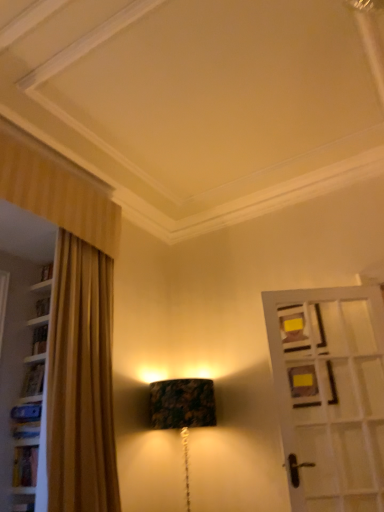
At what (x,y) coordinates should I click in order to perform the action: click on marble-patterned lampshade at center. Please return your answer as a coordinate pair (x, y). This screenshot has height=512, width=384. Looking at the image, I should click on (182, 410).

The width and height of the screenshot is (384, 512). Describe the element at coordinates (182, 410) in the screenshot. I see `marble-patterned lampshade at center` at that location.

What do you see at coordinates (330, 395) in the screenshot? I see `white wooden door at right` at bounding box center [330, 395].

Identify the location of white wooden door at right. This screenshot has height=512, width=384. (330, 395).

What is the approximate height of white wooden door at right?

It is 1.28 meters.

You are a GUI agent. You are given a task and a screenshot of the screen. Output one action in this format:
    pyautogui.click(x=<x>, y=<y>)
    Task: Click on the marble-patterned lampshade at center
    The image size is (384, 512).
    Given the screenshot: What is the action you would take?
    pyautogui.click(x=182, y=410)

Is white wooden door at right to the left of marble-patterned lampshade at center from the viewer's perspective?

Incorrect, white wooden door at right is not on the left side of marble-patterned lampshade at center.

Which is in front, white wooden door at right or marble-patterned lampshade at center?

Positioned in front is white wooden door at right.

Is point (331, 383) positioned after point (196, 426)?

No, it is in front of (196, 426).

From the image's perspective, which one is positioned higher, white wooden door at right or marble-patterned lampshade at center?

white wooden door at right is shown above in the image.

From the picture: From a real-world perspective, relative to marble-patterned lampshade at center, is white wooden door at right vertically above or below?

white wooden door at right is above marble-patterned lampshade at center.

Is white wooden door at right wider or thinner than marble-patterned lampshade at center?

In the image, white wooden door at right appears to be more narrow than marble-patterned lampshade at center.

Based on the photo, from their relative heights in the image, would you say white wooden door at right is taller or shorter than marble-patterned lampshade at center?

Clearly, white wooden door at right is taller compared to marble-patterned lampshade at center.

Can you confirm if white wooden door at right is smaller than marble-patterned lampshade at center?

Correct, white wooden door at right occupies less space than marble-patterned lampshade at center.

Is marble-patterned lampshade at center surrounded by white wooden door at right?

No.

Is white wooden door at right touching marble-patterned lampshade at center?

There is a gap between white wooden door at right and marble-patterned lampshade at center.

Is white wooden door at right oriented towards marble-patterned lampshade at center?

No, white wooden door at right is not turned towards marble-patterned lampshade at center.

At what (x,y) coordinates should I click in order to perform the action: click on door above the marble-patterned lampshade at center (from the image's perspective). Please return your answer as a coordinate pair (x, y). Looking at the image, I should click on (330, 395).

Considering the positions of objects marble-patterned lampshade at center and white wooden door at right in the image provided, who is more to the left, marble-patterned lampshade at center or white wooden door at right?

Positioned to the left is marble-patterned lampshade at center.

Is marble-patterned lampshade at center further to the viewer compared to white wooden door at right?

Yes.

Is point (198, 399) positioned after point (288, 459)?

That is True.

From the image's perspective, which is above, marble-patterned lampshade at center or white wooden door at right?

white wooden door at right is shown above in the image.

From a real-world perspective, does marble-patterned lampshade at center sit lower than white wooden door at right?

Yes, from a real-world perspective, marble-patterned lampshade at center is below white wooden door at right.

Is marble-patterned lampshade at center thinner than white wooden door at right?

In fact, marble-patterned lampshade at center might be wider than white wooden door at right.

Is marble-patterned lampshade at center shorter than white wooden door at right?

Yes, marble-patterned lampshade at center is shorter than white wooden door at right.

Based on their sizes in the image, would you say marble-patterned lampshade at center is bigger or smaller than white wooden door at right?

marble-patterned lampshade at center is bigger than white wooden door at right.

Is marble-patterned lampshade at center spatially inside white wooden door at right, or outside of it?

marble-patterned lampshade at center lies outside white wooden door at right.

Is marble-patterned lampshade at center in contact with white wooden door at right?

They are not placed beside each other.

Is marble-patterned lampshade at center positioned with its back to white wooden door at right?

marble-patterned lampshade at center is not turned away from white wooden door at right.

How many degrees apart are the facing directions of marble-patterned lampshade at center and white wooden door at right?

They differ by 59.6 degrees in their facing directions.

How far apart are marble-patterned lampshade at center and white wooden door at right?

marble-patterned lampshade at center and white wooden door at right are 30.95 inches apart from each other.

The width and height of the screenshot is (384, 512). Identify the location of door in front of the marble-patterned lampshade at center. (330, 395).

This screenshot has width=384, height=512. I want to click on table lamp on the left of the white wooden door at right, so [182, 410].

Identify the location of table lamp below the white wooden door at right (from the image's perspective). The height and width of the screenshot is (512, 384). (182, 410).